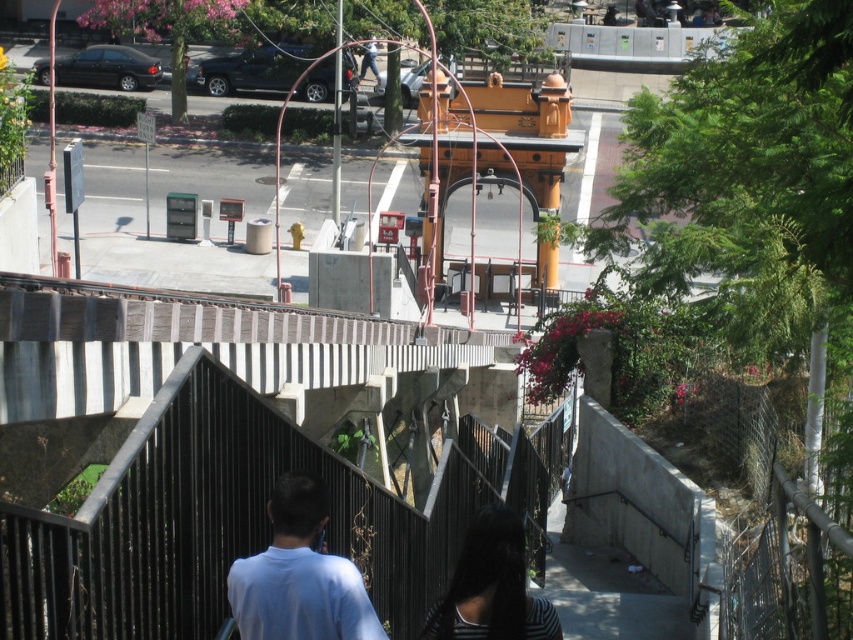
Is point (302, 576) positioned before point (485, 545)?

Yes, point (302, 576) is in front of point (485, 545).

Between point (273, 632) and point (500, 584), which one is positioned in front?

Point (273, 632) is in front.

Measure the distance between light blue t-shirt at center and camera.

Result: light blue t-shirt at center is 7.48 meters away from camera.

Locate an element on the screen. The height and width of the screenshot is (640, 853). light blue t-shirt at center is located at coordinates (299, 576).

Which is above, light blue cotton shirt at center or light blue t-shirt at center?

light blue t-shirt at center is above.

Can you confirm if light blue cotton shirt at center is positioned above light blue t-shirt at center?

No, light blue cotton shirt at center is not above light blue t-shirt at center.

At what (x,y) coordinates should I click in order to perform the action: click on light blue cotton shirt at center. Please return your answer as a coordinate pair (x, y). Looking at the image, I should click on (299, 576).

Which is more to the right, light blue cotton shirt at center or dark brown hair at center?

dark brown hair at center is more to the right.

Is light blue cotton shirt at center to the right of dark brown hair at center from the viewer's perspective?

Incorrect, light blue cotton shirt at center is not on the right side of dark brown hair at center.

Is point (239, 561) closer to camera compared to point (556, 634)?

Yes, it is.

The image size is (853, 640). What are the coordinates of `light blue cotton shirt at center` in the screenshot? It's located at point(299,576).